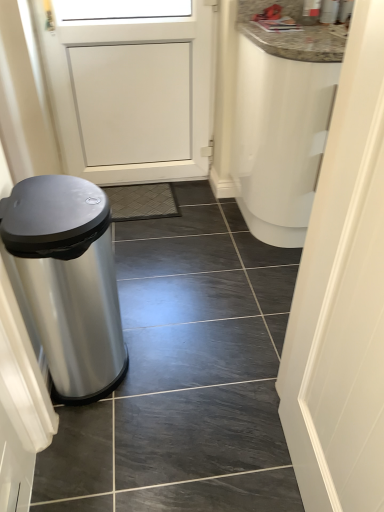
Measure the distance between point (39, 294) and camera.

The distance of point (39, 294) from camera is 1.19 meters.

Measure the distance between point (281,361) and camera.

Point (281,361) and camera are 4.58 feet apart.

Where is `polished stainless steel trash can at left`? This screenshot has width=384, height=512. polished stainless steel trash can at left is located at coordinates (69, 281).

The width and height of the screenshot is (384, 512). I want to click on door in front of the slate tile at left, so click(342, 297).

Is white matte door at right in contact with slate tile at left?

No, white matte door at right is not beside slate tile at left.

Is point (357, 368) positioned behind point (298, 502)?

That is False.

Based on the photo, is white matte door at right completely or partially outside of polished stainless steel trash can at left?

Yes.

Considering the relative sizes of white matte door at right and polished stainless steel trash can at left in the image provided, is white matte door at right shorter than polished stainless steel trash can at left?

Incorrect, the height of white matte door at right does not fall short of that of polished stainless steel trash can at left.

Locate an element on the screen. door located in front of the polished stainless steel trash can at left is located at coordinates (342, 297).

From a real-world perspective, is white matte door at right physically located above or below polished stainless steel trash can at left?

Clearly, from a real-world perspective, white matte door at right is above polished stainless steel trash can at left.

Where is `door in front of the slate tile at left`? This screenshot has height=512, width=384. door in front of the slate tile at left is located at coordinates (342, 297).

From the image's perspective, which one is positioned lower, slate tile at left or white matte door at right?

white matte door at right, from the image's perspective.

Can we say slate tile at left lies outside white matte door at right?

Yes, slate tile at left is outside of white matte door at right.

Can you confirm if slate tile at left is smaller than white matte door at right?

Yes.

Measure the distance from slate tile at left to polished stainless steel trash can at left.

A distance of 41.89 centimeters exists between slate tile at left and polished stainless steel trash can at left.

Considering the sizes of objects slate tile at left and polished stainless steel trash can at left in the image provided, who is bigger, slate tile at left or polished stainless steel trash can at left?

Bigger between the two is polished stainless steel trash can at left.

Is slate tile at left spatially inside polished stainless steel trash can at left, or outside of it?

slate tile at left is outside polished stainless steel trash can at left.

From a real-world perspective, is polished stainless steel trash can at left over white matte door at right?

No.

Considering the positions of objects polished stainless steel trash can at left and white matte door at right in the image provided, who is more to the right, polished stainless steel trash can at left or white matte door at right?

Positioned to the right is white matte door at right.

Is polished stainless steel trash can at left facing away from white matte door at right?

No, polished stainless steel trash can at left's orientation is not away from white matte door at right.

Between polished stainless steel trash can at left and white matte door at right, which one has less height?

polished stainless steel trash can at left is shorter.

Is slate tile at left surrounded by polished stainless steel trash can at left?

No, slate tile at left is not inside polished stainless steel trash can at left.

In the scene shown: From a real-world perspective, relative to slate tile at left, is polished stainless steel trash can at left vertically above or below?

Clearly, from a real-world perspective, polished stainless steel trash can at left is above slate tile at left.

Is polished stainless steel trash can at left not close to slate tile at left?

They are positioned close to each other.

Locate an element on the screen. waste container in front of the slate tile at left is located at coordinates (69, 281).

This screenshot has height=512, width=384. Find the location of `tile behind the white matte door at right`. tile behind the white matte door at right is located at coordinates (185, 375).

Find the location of a particular element. This screenshot has height=512, width=384. door in front of the polished stainless steel trash can at left is located at coordinates (342, 297).

Based on their spatial positions, is white matte door at right or polished stainless steel trash can at left closer to slate tile at left?

polished stainless steel trash can at left is positioned closer to the anchor slate tile at left.

From the image, which object appears to be farther from white matte door at right, polished stainless steel trash can at left or slate tile at left?

polished stainless steel trash can at left is positioned further to the anchor white matte door at right.

From the image, which object appears to be nearer to slate tile at left, polished stainless steel trash can at left or white matte door at right?

polished stainless steel trash can at left lies closer to slate tile at left than the other object.

Estimate the real-world distances between objects in this image. Which object is further from polished stainless steel trash can at left, white matte door at right or slate tile at left?

white matte door at right is further to polished stainless steel trash can at left.

Consider the image. Looking at the image, which one is located closer to white matte door at right, slate tile at left or polished stainless steel trash can at left?

slate tile at left lies closer to white matte door at right than the other object.

Looking at the image, which one is located closer to polished stainless steel trash can at left, slate tile at left or white matte door at right?

Based on the image, slate tile at left appears to be nearer to polished stainless steel trash can at left.

At what (x,y) coordinates should I click in order to perform the action: click on waste container between white matte door at right and slate tile at left along the z-axis. Please return your answer as a coordinate pair (x, y). The image size is (384, 512). Looking at the image, I should click on (69, 281).